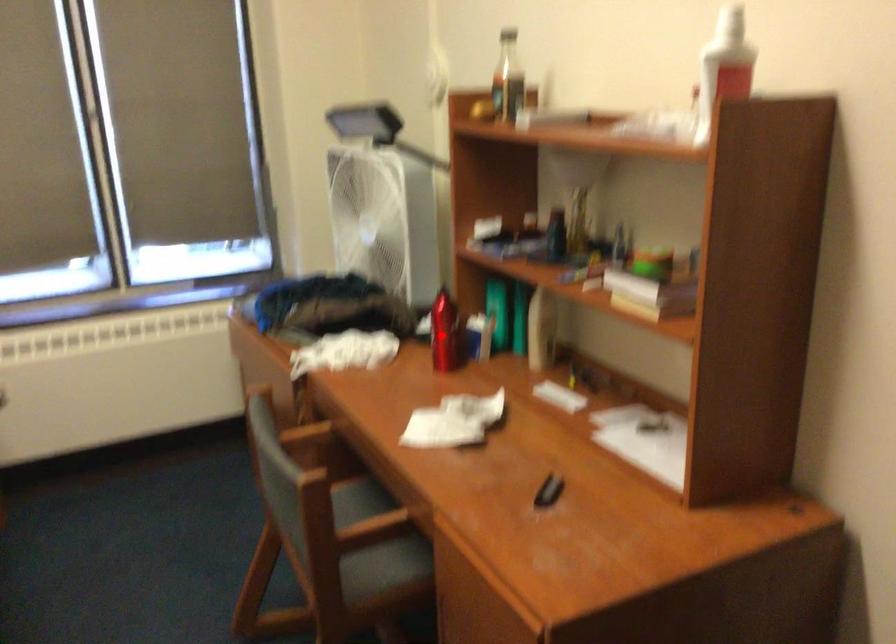
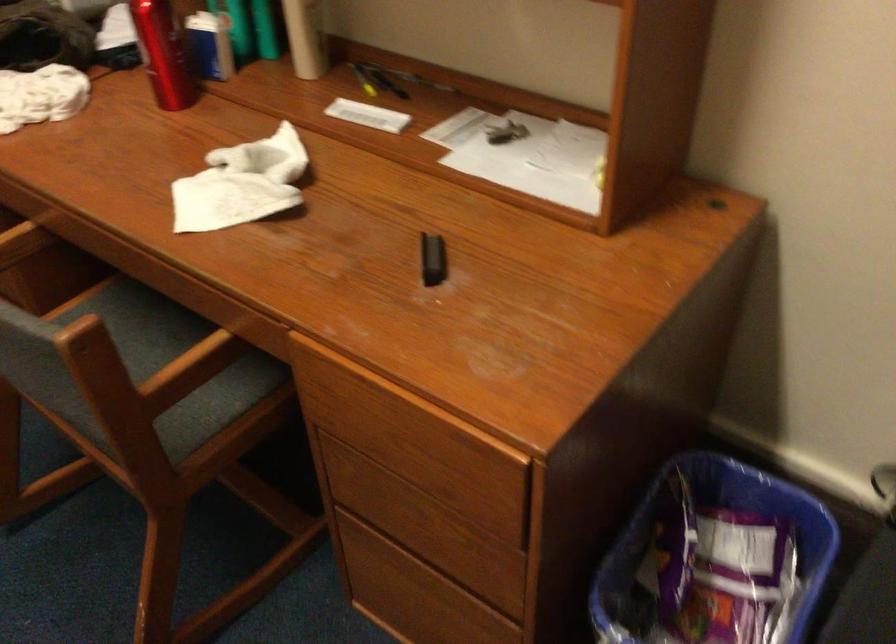
Question: I am providing you with two images of the same scene from different viewpoints. A red point is marked on the first image. Is the red point's position out of view in image 2?

Choices:
 (A) Yes
 (B) No

Answer: (B)